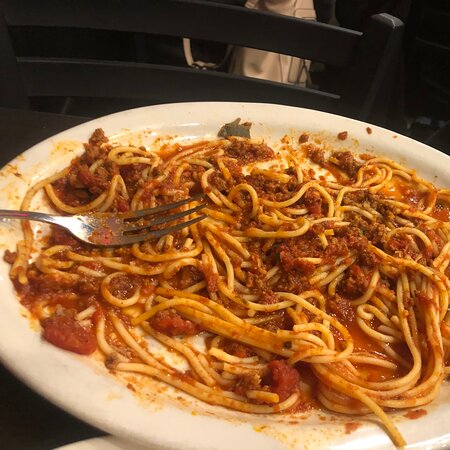
Locate an element on the screen. The image size is (450, 450). fork is located at coordinates (81, 222).